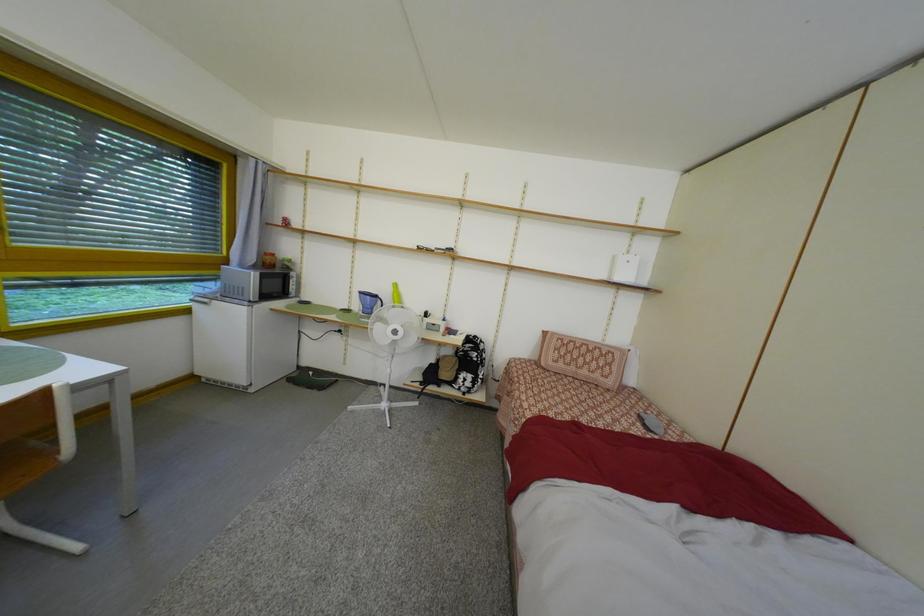
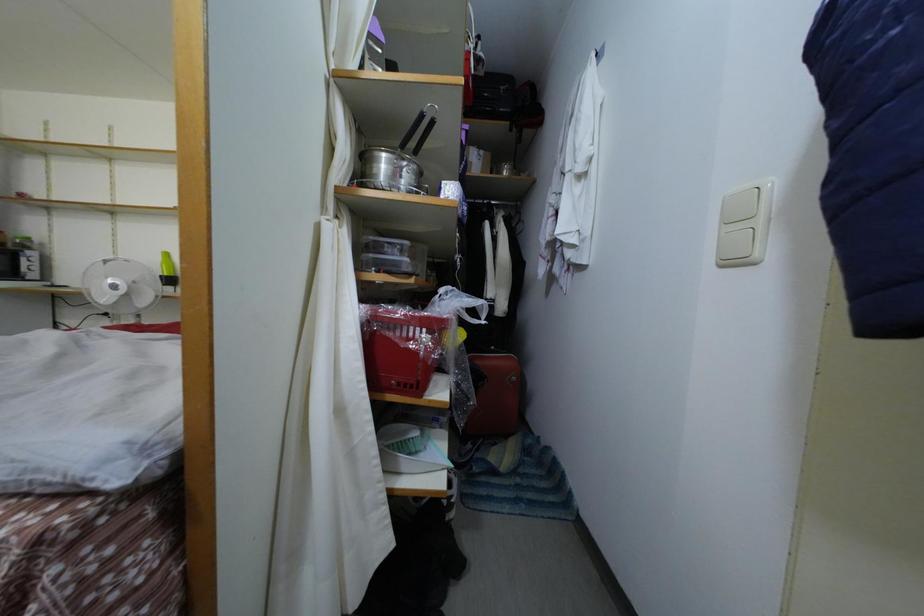
Question: What movement of the cameraman would produce the second image?

Choices:
 (A) Left
 (B) Right
 (C) Forward
 (D) Backward

Answer: (B)